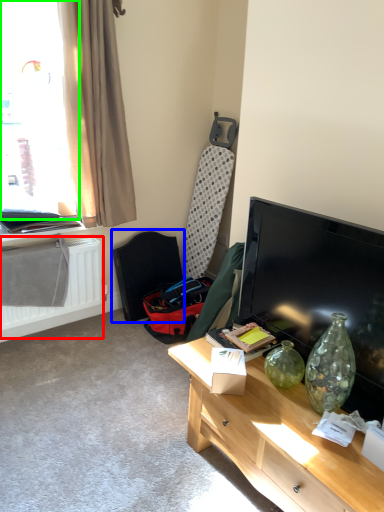
Question: Which object is the closest to the radiator (highlighted by a red box)? Choose among these: swivel chair (highlighted by a blue box) or window (highlighted by a green box).

Choices:
 (A) swivel chair
 (B) window

Answer: (A)